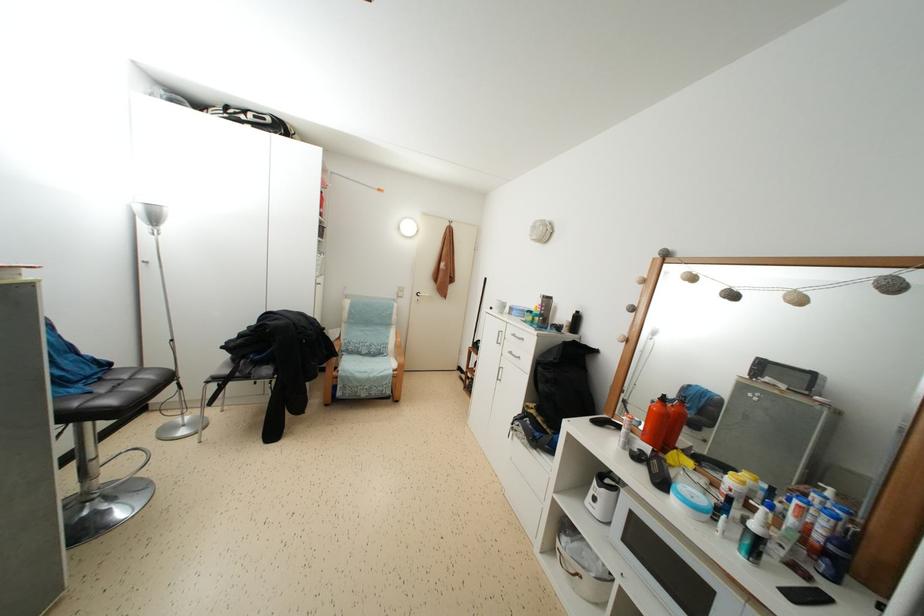
At what (x,y) coordinates should I click in order to perform the action: click on silver door handle. Please return your answer as a coordinate pair (x, y). Looking at the image, I should click on (423, 294).